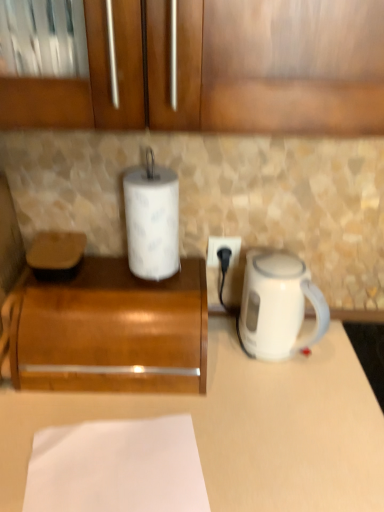
I want to click on vacant space in front of wooden at left, so [110, 431].